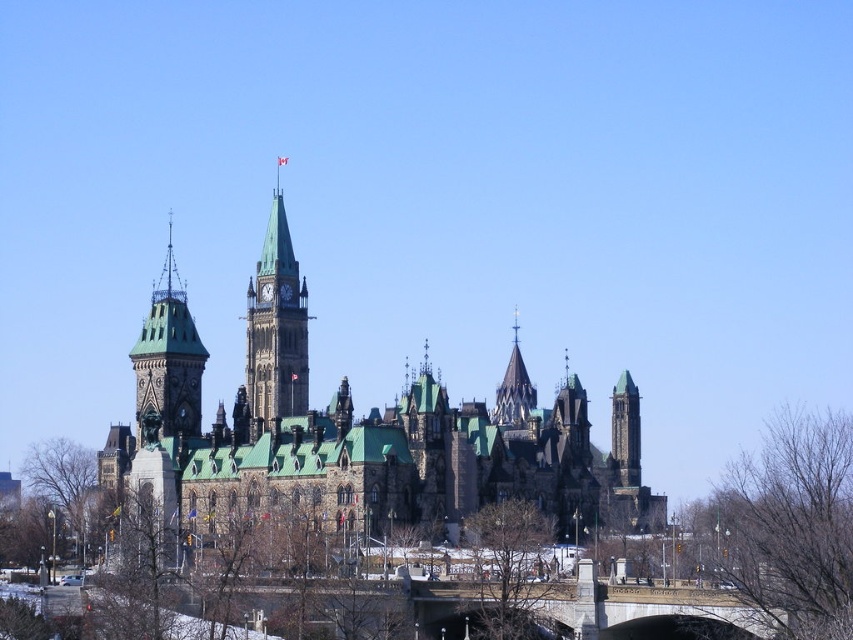
Question: Estimate the real-world distances between objects in this image. Which object is closer to the dark gray stone castle at center?

Choices:
 (A) green stone clock tower at center
 (B) dark brown stone clock tower at left

Answer: (A)

Question: Which object is positioned farthest from the polished stone spire at center?

Choices:
 (A) dark brown stone clock tower at left
 (B) dark gray stone castle at center

Answer: (A)

Question: From the image, what is the correct spatial relationship of green stone clock tower at center in relation to dark gray stone tower at center right?

Choices:
 (A) above
 (B) below

Answer: (A)

Question: Which of the following is the farthest from the observer?

Choices:
 (A) (170, 244)
 (B) (512, 397)

Answer: (B)

Question: Does dark brown stone clock tower at left appear under dark gray stone tower at center right?

Choices:
 (A) yes
 (B) no

Answer: (B)

Question: Can you confirm if dark brown stone clock tower at left is positioned to the left of polished stone spire at center?

Choices:
 (A) yes
 (B) no

Answer: (A)